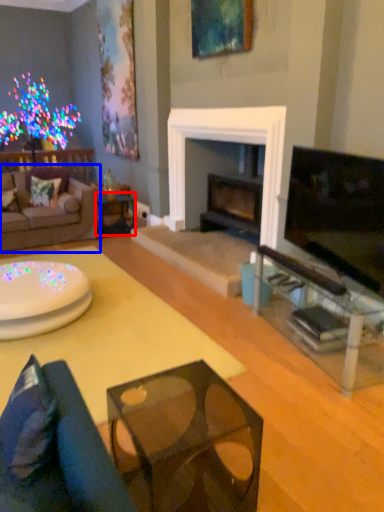
Question: Which object is closer to the camera taking this photo, side table (highlighted by a red box) or studio couch (highlighted by a blue box)?

Choices:
 (A) side table
 (B) studio couch

Answer: (B)